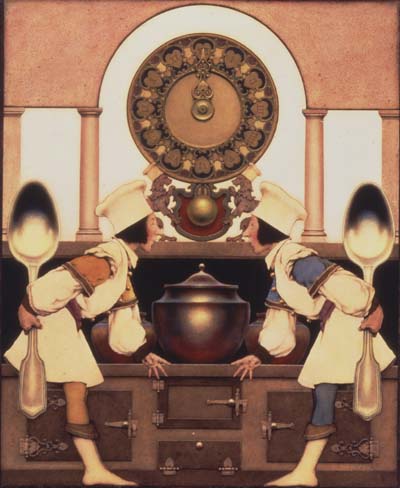
The height and width of the screenshot is (488, 400). Identify the location of wall. (333, 32).